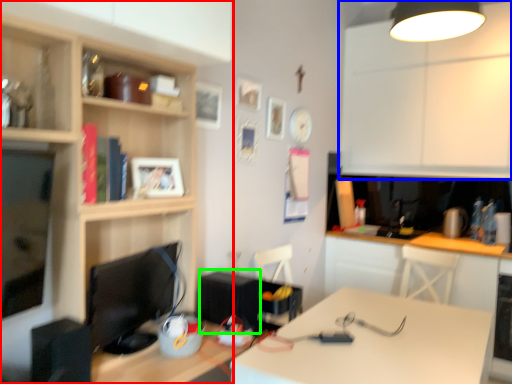
Question: Based on their relative distances, which object is nearer to cabinetry (highlighted by a red box)? Choose from cabinetry (highlighted by a blue box) and appliance (highlighted by a green box).

Choices:
 (A) cabinetry
 (B) appliance

Answer: (B)